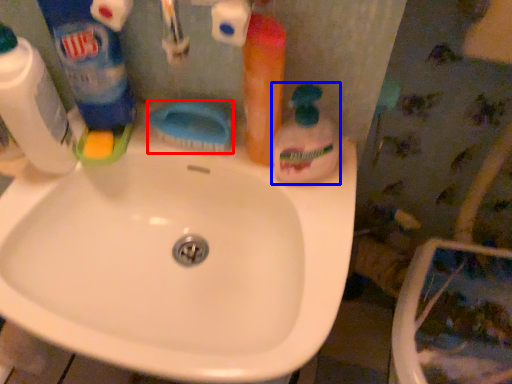
Question: Which object appears closest to the camera in this image, brush (highlighted by a red box) or cleaning product (highlighted by a blue box)?

Choices:
 (A) brush
 (B) cleaning product

Answer: (B)